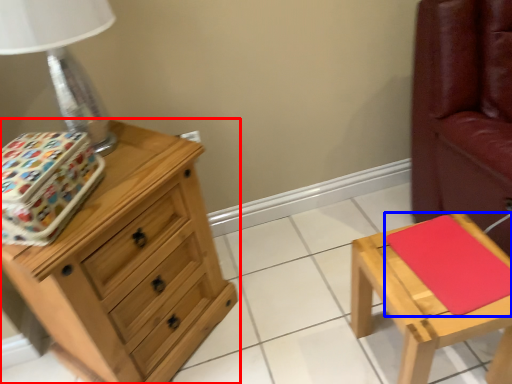
Question: Which object is further to the camera taking this photo, chest of drawers (highlighted by a red box) or pad (highlighted by a blue box)?

Choices:
 (A) chest of drawers
 (B) pad

Answer: (B)